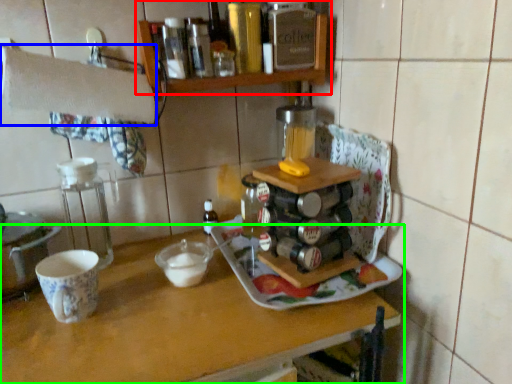
Question: Which object is the closest to the shelf (highlighted by a red box)? Choose among these: towel bar (highlighted by a blue box) or table (highlighted by a green box).

Choices:
 (A) towel bar
 (B) table

Answer: (A)